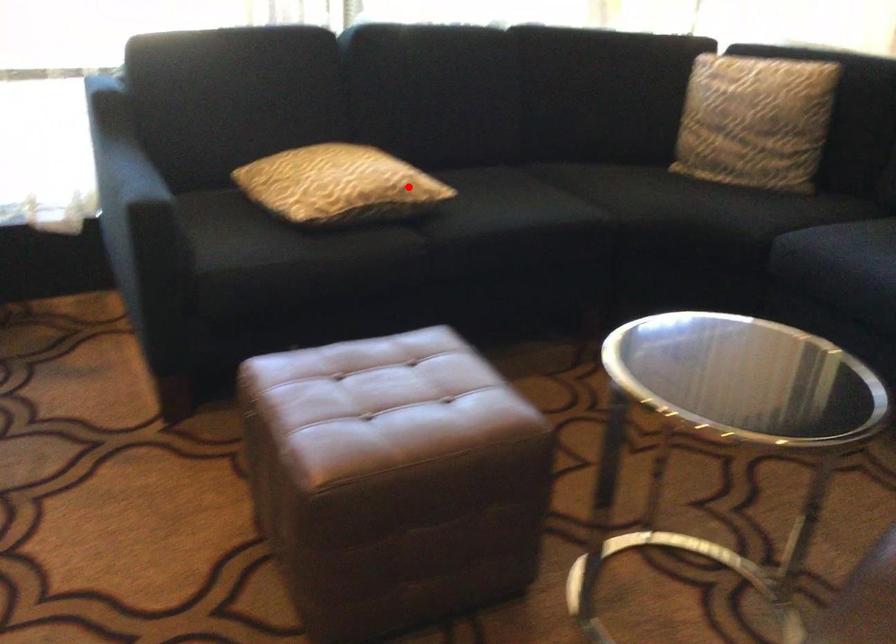
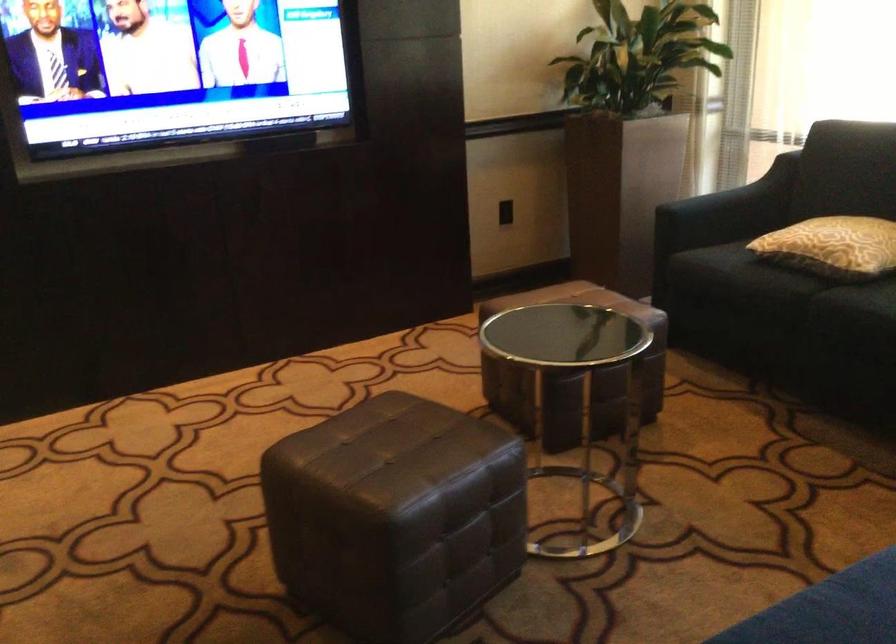
Question: I am providing you with two images of the same scene from different viewpoints. In image1, a red point is highlighted. Considering the same 3D point in image2, which of the following is correct?

Choices:
 (A) It is closer
 (B) It is farther

Answer: (B)